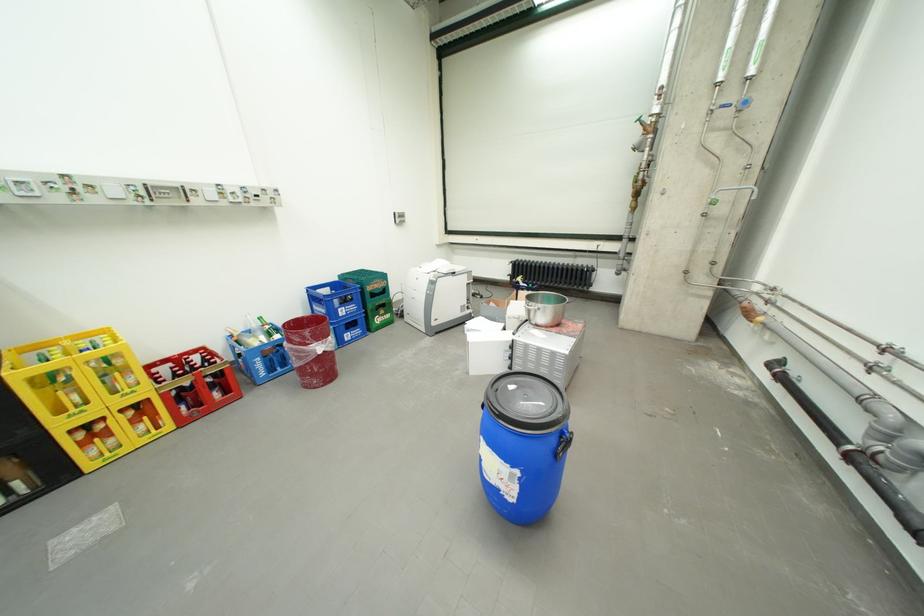
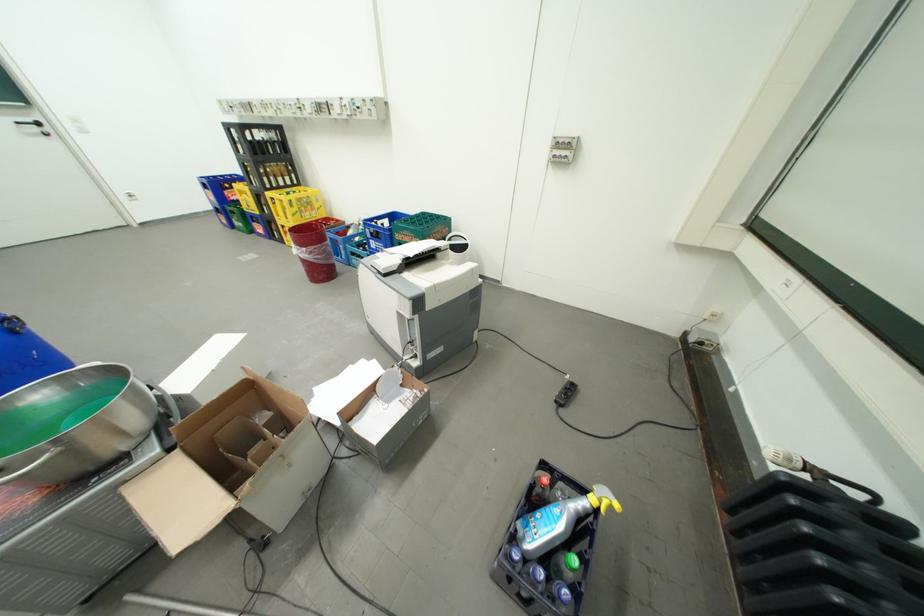
In the second image, find the point that corresponds to the point at 531,278 in the first image.

(622, 509)